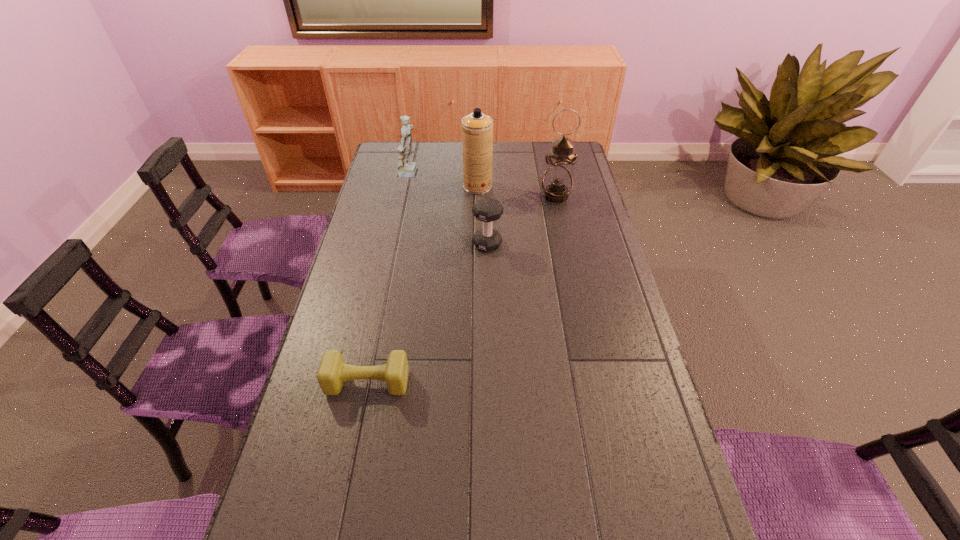
Where is `free space at the far right corner of the desktop`? The height and width of the screenshot is (540, 960). free space at the far right corner of the desktop is located at coordinates (542, 146).

This screenshot has width=960, height=540. Identify the location of vacant space that is in between the fourth tallest object and the third tallest object. (449, 210).

The width and height of the screenshot is (960, 540). Identify the location of free spot between the aerosol can and the nearest object. (422, 285).

At what (x,y) coordinates should I click in order to perform the action: click on vacant region between the figurine and the aerosol can. Please return your answer as a coordinate pair (x, y). Looking at the image, I should click on (444, 180).

The width and height of the screenshot is (960, 540). What are the coordinates of `vacant region between the rightmost object and the nearest object` in the screenshot? It's located at (462, 289).

The image size is (960, 540). Find the location of `free area in between the nearest object and the oil lamp`. free area in between the nearest object and the oil lamp is located at coordinates (462, 289).

Where is `free point between the second shortest object and the nearer dumbbell`? This screenshot has height=540, width=960. free point between the second shortest object and the nearer dumbbell is located at coordinates (427, 313).

Find the location of a particular element. free spot between the aerosol can and the figurine is located at coordinates (444, 180).

Locate an element on the screen. The height and width of the screenshot is (540, 960). vacant area between the taller dumbbell and the rightmost object is located at coordinates (521, 220).

Find the location of a particular element. The image size is (960, 540). object that is the closest to the aerosol can is located at coordinates (406, 168).